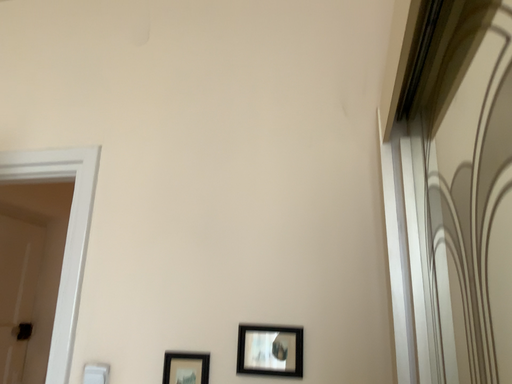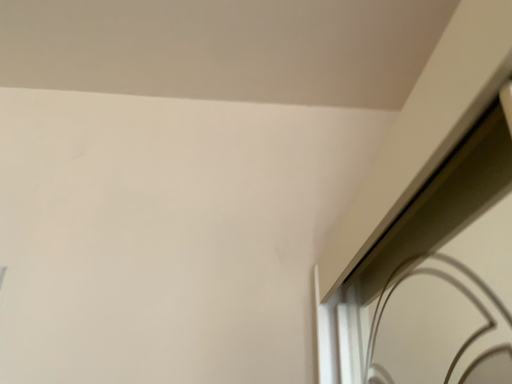
Question: Which way did the camera rotate in the video?

Choices:
 (A) rotated right
 (B) rotated left

Answer: (A)